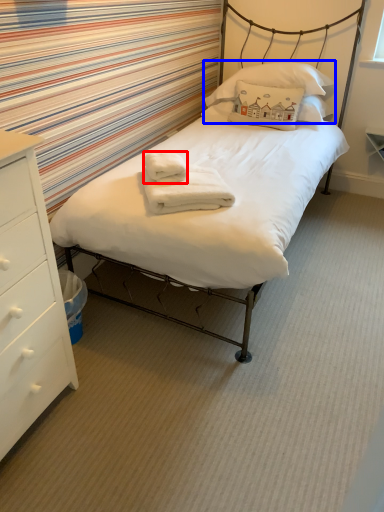
Question: Which object is further to the camera taking this photo, bath towel (highlighted by a red box) or pillow (highlighted by a blue box)?

Choices:
 (A) bath towel
 (B) pillow

Answer: (B)